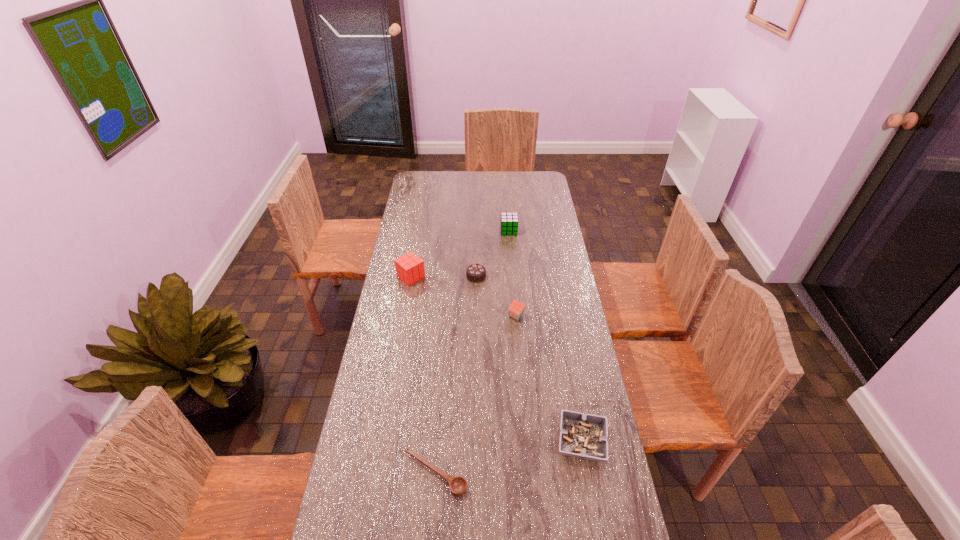
Locate an element on the screen. Image resolution: width=960 pixels, height=540 pixels. free space located 0.110m on the front of the farthest cube is located at coordinates tap(511, 249).

I want to click on vacant region located 0.280m on the left of the third nearest object, so click(x=436, y=316).

This screenshot has width=960, height=540. I want to click on vacant space located 0.060m on the left of the chocolate cake, so click(x=452, y=276).

Identify the location of free space located 0.290m on the back of the rightmost object. (564, 347).

I want to click on vacant space situated 0.140m on the back of the wooden spoon, so point(440,410).

This screenshot has height=540, width=960. What are the coordinates of `object situated at the left edge` in the screenshot? It's located at click(409, 268).

The image size is (960, 540). Identify the location of object that is positioned at the right edge. (584, 436).

Find the location of `vacant space at the far edge of the desktop`. vacant space at the far edge of the desktop is located at coordinates (483, 187).

In the image, there is a desktop. Where is `vacant space at the left edge`? vacant space at the left edge is located at coordinates (396, 381).

Image resolution: width=960 pixels, height=540 pixels. Find the location of `vacant space at the right edge`. vacant space at the right edge is located at coordinates (541, 228).